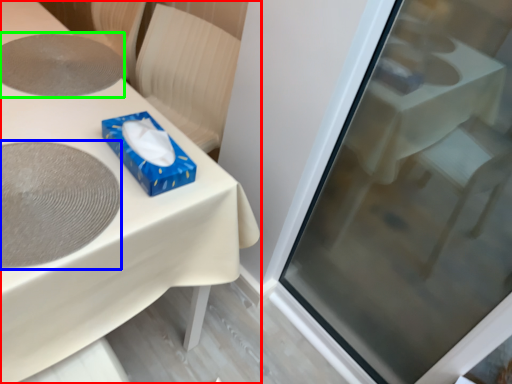
Question: Based on their relative distances, which object is nearer to table (highlighted by a red box)? Choose from oval (highlighted by a blue box) and oval (highlighted by a green box).

Choices:
 (A) oval
 (B) oval

Answer: (A)